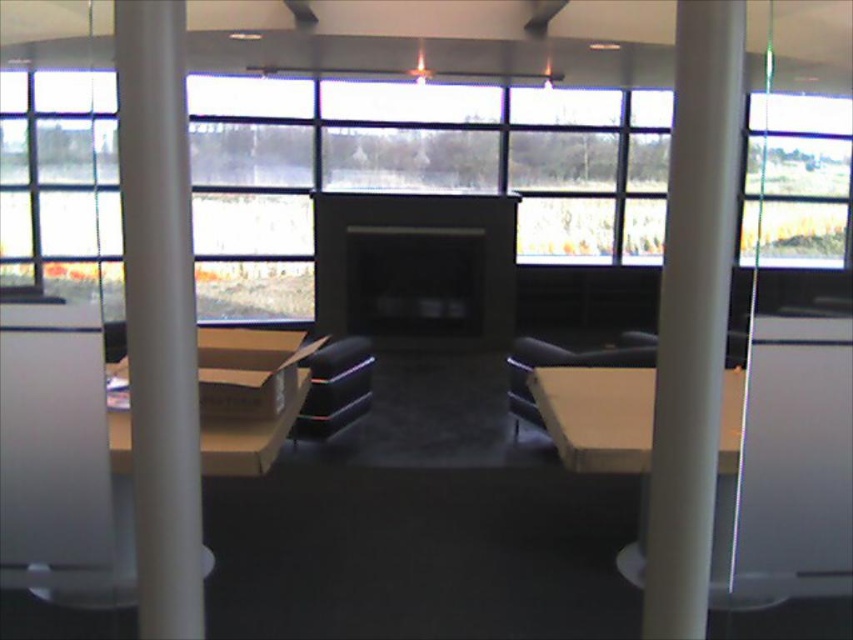
You are standing in the room and want to move towards the white smooth pillar at center. Based on the coordinates provided, which direction should you walk to reach it?

The white smooth pillar at center is located at coordinates point (693, 314), so you should walk towards the center of the room to reach it.

You are a delivery person who needs to place a heavy package on a surface. You see the transparent glass window at upper right and the matte brown table at center. Which surface is suitable for placing the package?

The matte brown table at center is suitable for placing the heavy package because the transparent glass window at upper right is located above it and is likely not a stable surface.